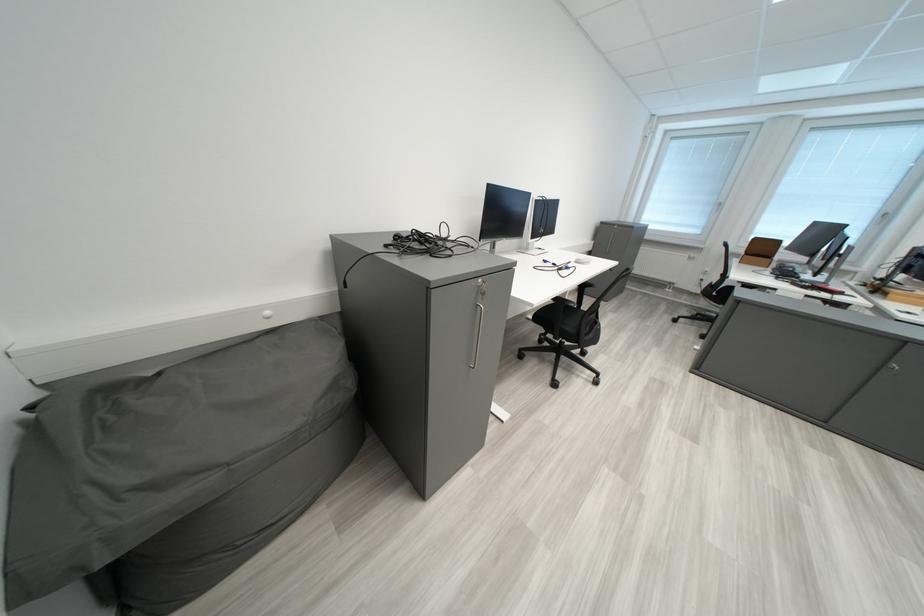
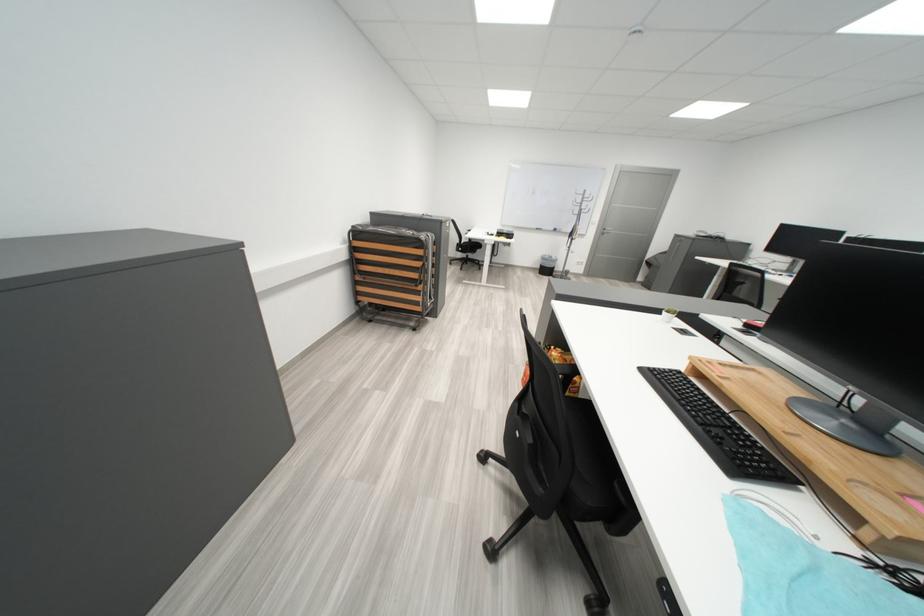
Question: I am providing you with two images of the same scene from different viewpoints. After the viewpoint changes to image2, which objects are now occluded?

Choices:
 (A) black trash can
 (B) cabinet key
 (C) black chair armrest
 (D) green soap bottle

Answer: (B)